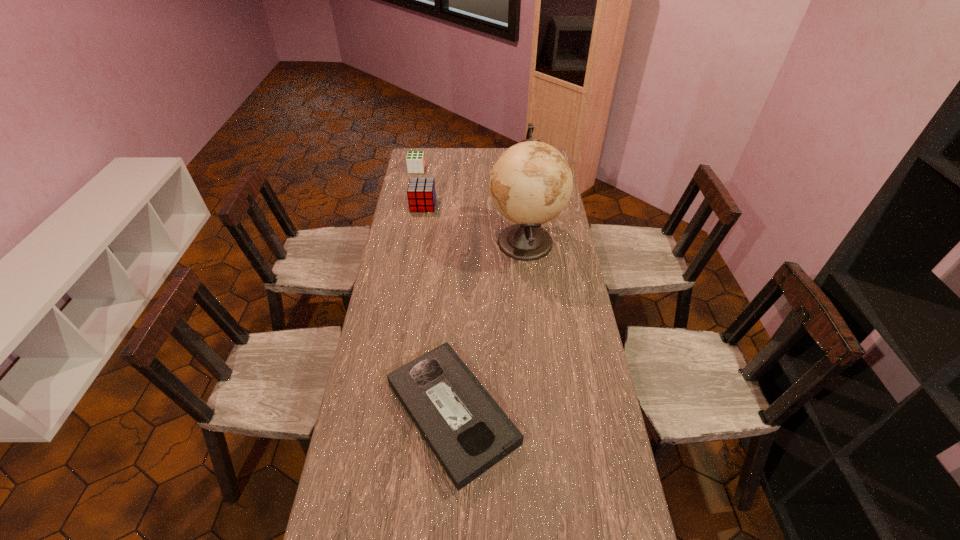
In the image, there is a desktop. In order to click on free space at the right edge in this screenshot , I will do `click(578, 421)`.

The image size is (960, 540). In order to click on empty location between the third farthest object and the third shortest object in this screenshot , I will do `click(474, 224)`.

At what (x,y) coordinates should I click in order to perform the action: click on vacant space in between the nearest object and the globe. Please return your answer as a coordinate pair (x, y). Image resolution: width=960 pixels, height=540 pixels. Looking at the image, I should click on (489, 327).

The image size is (960, 540). Identify the location of vacant area between the videotape and the second shortest object. (435, 291).

Find the location of a particular element. The image size is (960, 540). free point between the nearest object and the shorter cube is located at coordinates (435, 291).

Find the location of a particular element. free area in between the tallest object and the second shortest object is located at coordinates (470, 205).

The height and width of the screenshot is (540, 960). Identify the location of vacant space in between the farther cube and the shortest object. (435, 291).

Image resolution: width=960 pixels, height=540 pixels. In order to click on free spot between the tallest object and the shortest object in this screenshot , I will do `click(489, 327)`.

At what (x,y) coordinates should I click in order to perform the action: click on empty location between the third farthest object and the farthest object. Please return your answer as a coordinate pair (x, y). Looking at the image, I should click on (470, 205).

Where is `vacant space that is in between the globe and the third tallest object`? The height and width of the screenshot is (540, 960). vacant space that is in between the globe and the third tallest object is located at coordinates (470, 205).